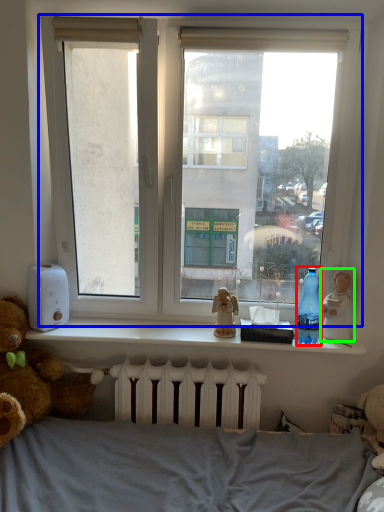
Question: Estimate the real-world distances between objects in this image. Which object is farther from bottle (highlighted by a red box), window (highlighted by a blue box) or figurine (highlighted by a green box)?

Choices:
 (A) window
 (B) figurine

Answer: (A)